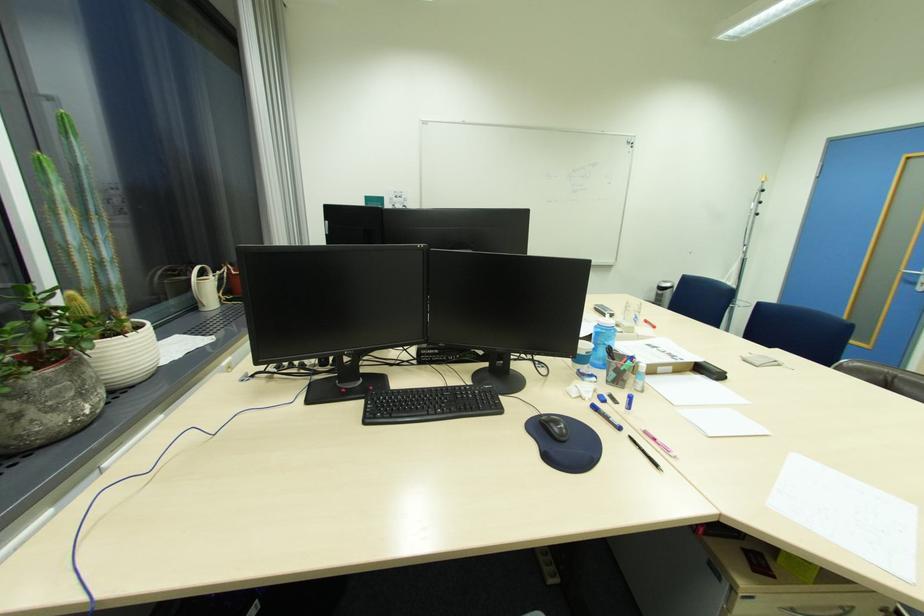
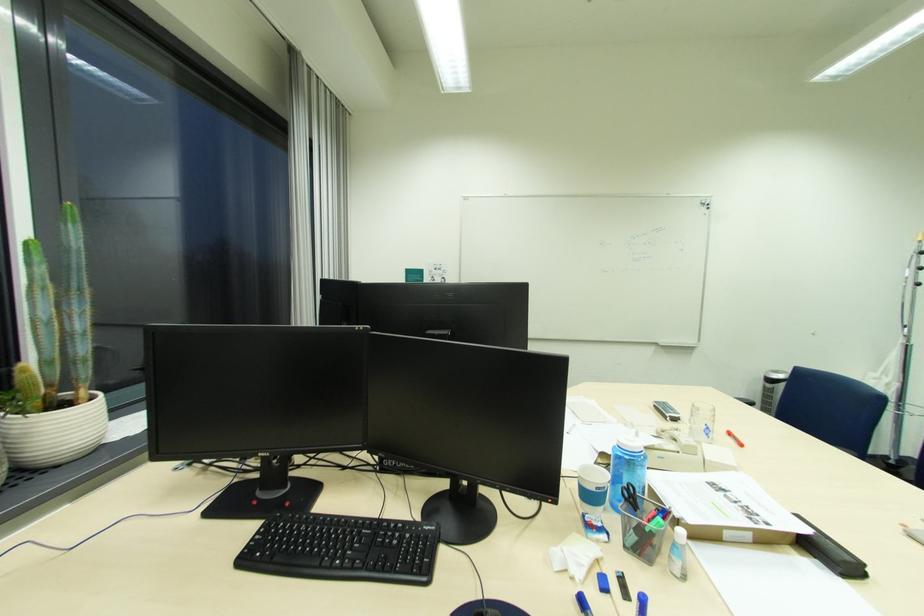
Where in the second image is the point corresponding to the point at 650,322 from the first image?

(736, 435)